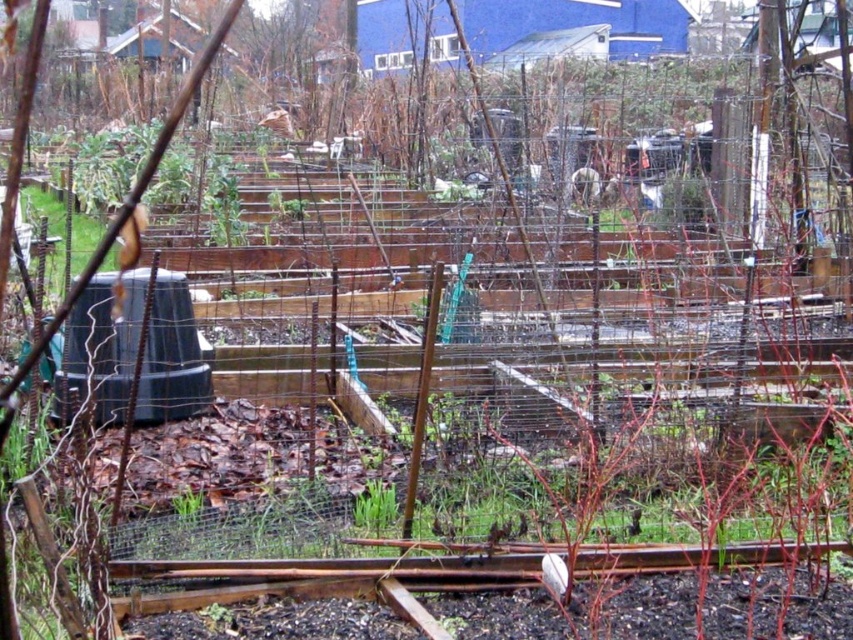
You are a gardener looking at the community garden scene. You see a green leafy plant at center and a green grass at center. Which one is located to the right of the other?

The green leafy plant at center is positioned on the right side of green grass at center.

You are standing at the entrance of the community garden and see two points marked in the image. The first point is at coordinate point (360, 525) and the second is at point (180, 509). Which point is closer to you?

Point (360, 525) is in front of point (180, 509), so the first point is closer to you.